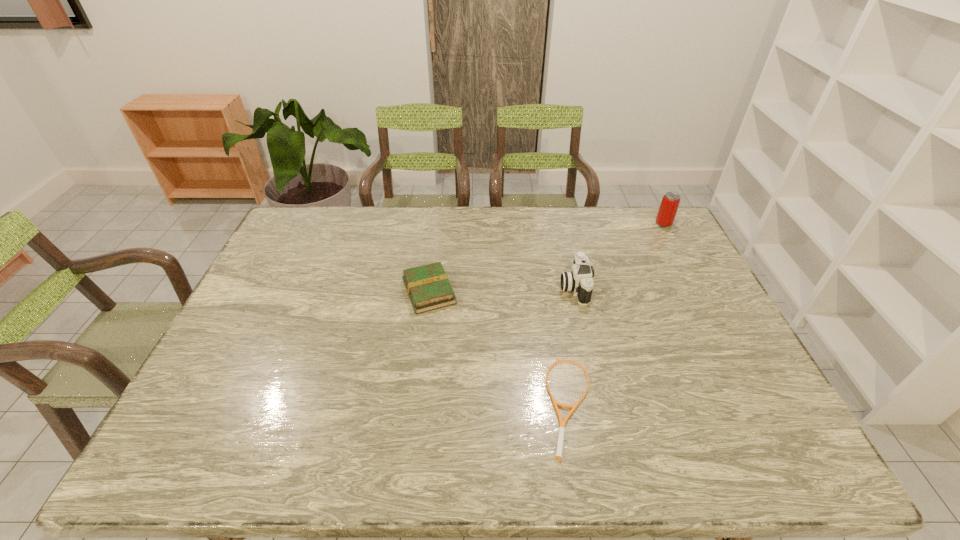
Identify the location of object that stands as the third closest to the tallest object. (428, 287).

Where is `vacant space that satisfies the following two spatial constraints: 1. on the front side of the book; 2. on the left side of the shortest object`? vacant space that satisfies the following two spatial constraints: 1. on the front side of the book; 2. on the left side of the shortest object is located at coordinates (415, 406).